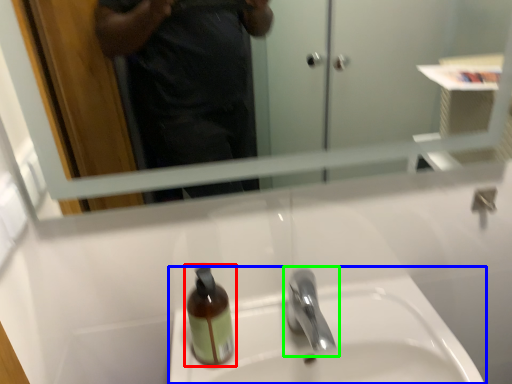
Question: Which object is the closest to the bottle (highlighted by a red box)? Choose among these: sink (highlighted by a blue box) or tap (highlighted by a green box).

Choices:
 (A) sink
 (B) tap

Answer: (B)